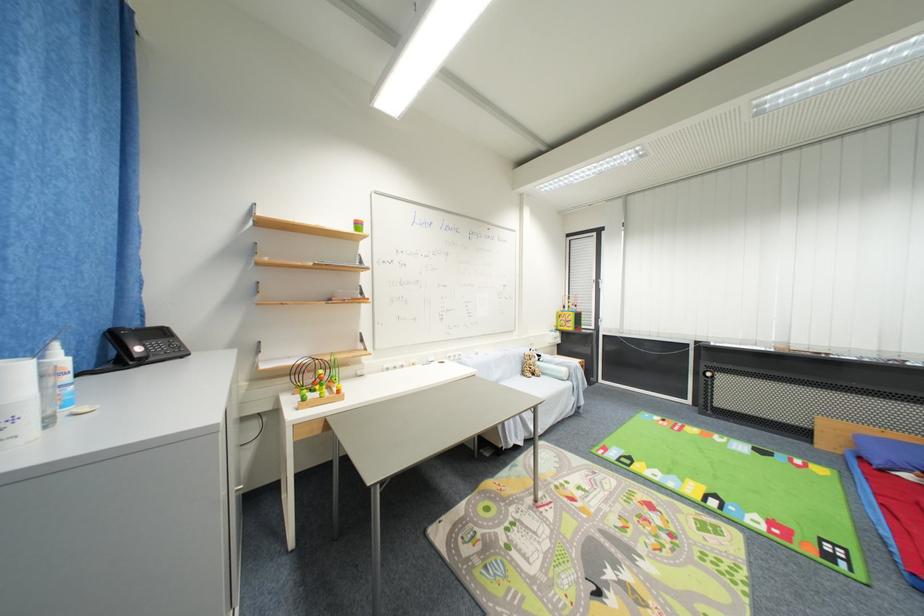
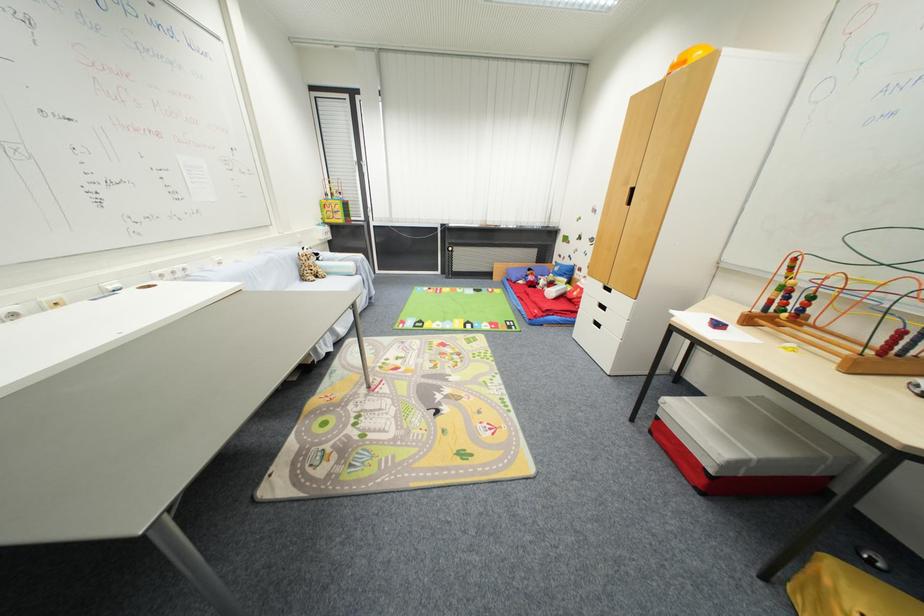
Find the pixel in the second image that matches point (533, 371) in the first image.

(313, 274)